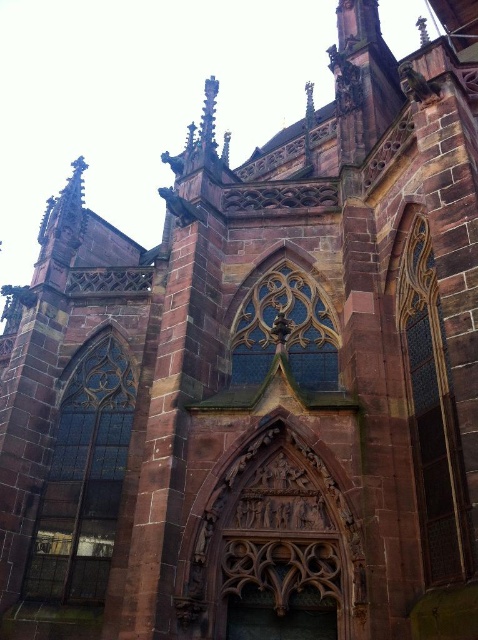
You are standing in front of the Gothic church and want to take a photo of the stained glass window at left. According to the coordinates provided, where exactly should you position yourself to capture the entire window in your shot?

The stained glass window at left is located at point (84, 481), so you should position yourself directly in front of that coordinate to ensure the entire window is captured in your photo.

Looking at this image, you are an architect examining the Gothic church facade. You notice two stained glass sections, the dark stained glass window at right and the translucent stained glass at center. Which of these occupies a smaller area on the facade?

The dark stained glass window at right occupies less space than the translucent stained glass at center, so the dark stained glass window at right is the smaller one.